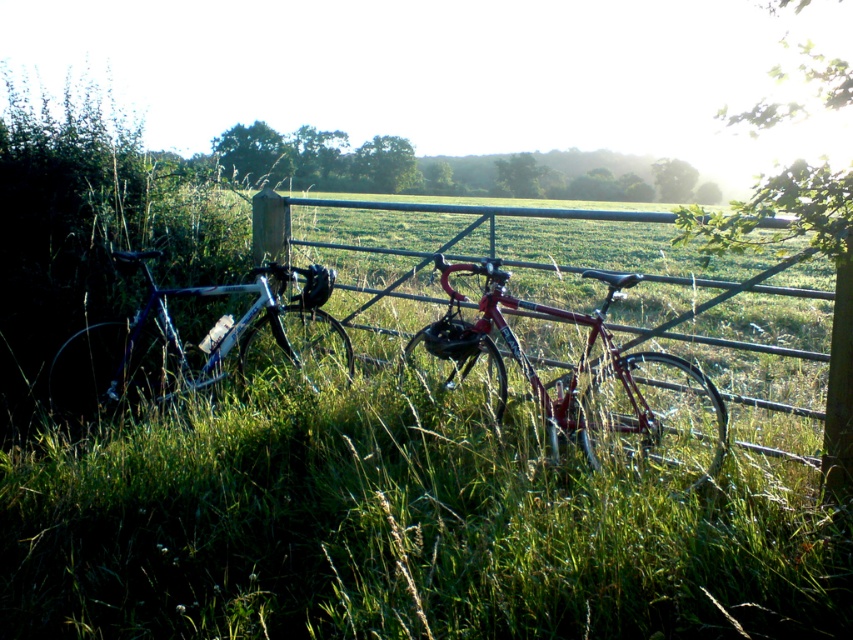
Is shiny silver bicycle at left wider than metallic gate at center?

No.

Consider the image. Which of these two, shiny silver bicycle at left or metallic gate at center, stands shorter?

With less height is shiny silver bicycle at left.

Who is more distant from viewer, (306, 289) or (265, 189)?

The point (265, 189) is behind.

This screenshot has width=853, height=640. Identify the location of shiny silver bicycle at left. (199, 340).

What do you see at coordinates (576, 378) in the screenshot? I see `shiny metallic bicycle at center` at bounding box center [576, 378].

Is shiny metallic bicycle at center shorter than metallic gate at center?

Yes, shiny metallic bicycle at center is shorter than metallic gate at center.

Identify the location of shiny metallic bicycle at center. (576, 378).

Where is `shiny metallic bicycle at center`? This screenshot has width=853, height=640. shiny metallic bicycle at center is located at coordinates (576, 378).

Which of these two, shiny metallic bicycle at center or shiny silver bicycle at left, stands shorter?

With less height is shiny silver bicycle at left.

Which is more to the left, shiny metallic bicycle at center or shiny silver bicycle at left?

Positioned to the left is shiny silver bicycle at left.

Which is behind, point (706, 404) or point (70, 348)?

Point (70, 348)

The image size is (853, 640). I want to click on shiny metallic bicycle at center, so click(x=576, y=378).